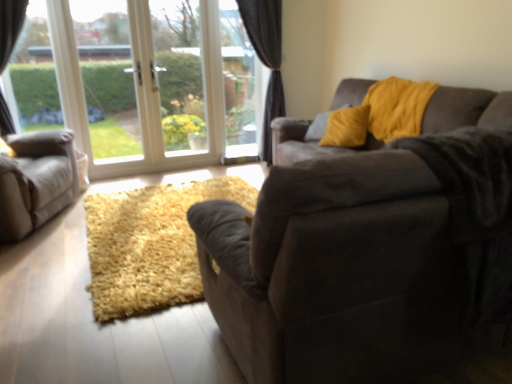
Question: Does transparent glass window screen at center, the first window screen when ordered from right to left, come behind transparent glass door at upper left, the 3th window screen from the right?

Choices:
 (A) no
 (B) yes

Answer: (B)

Question: From a real-world perspective, is transparent glass window screen at center, the 3th window screen positioned from the left, on top of transparent glass door at upper left, the 3th window screen from the right?

Choices:
 (A) no
 (B) yes

Answer: (A)

Question: Is transparent glass door at upper left, the 3th window screen from the right, a part of transparent glass window screen at center, the 3th window screen positioned from the left?

Choices:
 (A) yes
 (B) no

Answer: (B)

Question: Is transparent glass window screen at center, the first window screen when ordered from right to left, positioned with its back to transparent glass door at upper left, positioned as the 1th window screen in left-to-right order?

Choices:
 (A) no
 (B) yes

Answer: (A)

Question: Can you confirm if transparent glass window screen at center, the 3th window screen positioned from the left, is shorter than transparent glass door at upper left, positioned as the 1th window screen in left-to-right order?

Choices:
 (A) no
 (B) yes

Answer: (A)

Question: Does transparent glass window screen at center, the 3th window screen positioned from the left, have a greater width compared to transparent glass door at upper left, positioned as the 1th window screen in left-to-right order?

Choices:
 (A) yes
 (B) no

Answer: (B)

Question: Can you confirm if yellow velvet pillow at upper right is positioned to the left of suede couch at center, which is the 1th studio couch in right-to-left order?

Choices:
 (A) yes
 (B) no

Answer: (A)

Question: Is yellow velvet pillow at upper right positioned far away from suede couch at center, which is the 1th studio couch in right-to-left order?

Choices:
 (A) yes
 (B) no

Answer: (A)

Question: Can you confirm if yellow velvet pillow at upper right is positioned to the right of suede couch at center, the second studio couch when ordered from left to right?

Choices:
 (A) yes
 (B) no

Answer: (B)

Question: Considering the relative sizes of yellow velvet pillow at upper right and suede couch at center, which is the 1th studio couch in right-to-left order, in the image provided, is yellow velvet pillow at upper right shorter than suede couch at center, which is the 1th studio couch in right-to-left order,?

Choices:
 (A) yes
 (B) no

Answer: (A)

Question: Is yellow velvet pillow at upper right positioned behind suede couch at center, which is the 1th studio couch in right-to-left order?

Choices:
 (A) yes
 (B) no

Answer: (A)

Question: From a real-world perspective, is yellow velvet pillow at upper right located higher than suede couch at center, which is the 1th studio couch in right-to-left order?

Choices:
 (A) yes
 (B) no

Answer: (A)

Question: Would you say dark gray velvet curtain at center is a long distance from transparent glass door at upper left, the 3th window screen from the right?

Choices:
 (A) no
 (B) yes

Answer: (B)